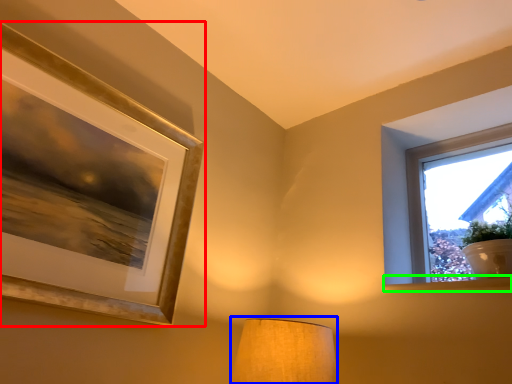
Question: Considering the real-world distances, which object is closest to picture frame (highlighted by a red box)? lamp (highlighted by a blue box) or window sill (highlighted by a green box).

Choices:
 (A) lamp
 (B) window sill

Answer: (A)